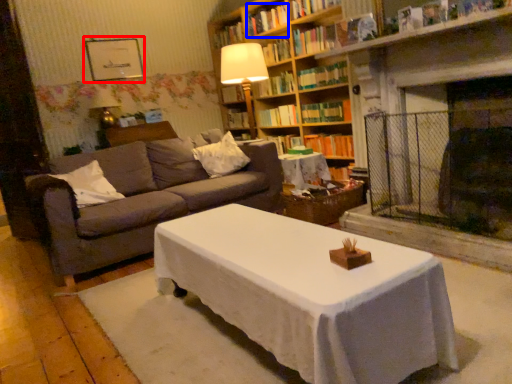
Question: Which object appears closest to the camera in this image, picture frame (highlighted by a red box) or book (highlighted by a blue box)?

Choices:
 (A) picture frame
 (B) book

Answer: (B)